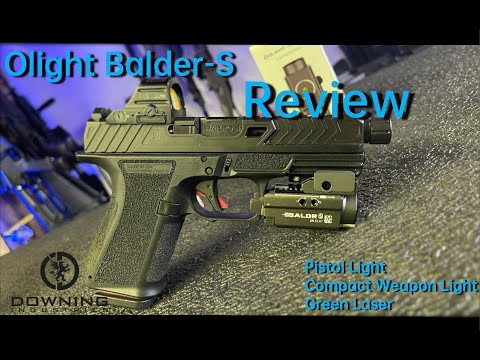
Find the location of a particular element. This screenshot has width=480, height=360. surface is located at coordinates (211, 270).